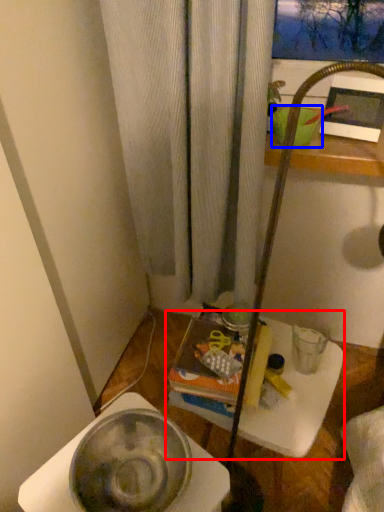
Question: Among these objects, which one is farthest to the camera, table (highlighted by a red box) or basin (highlighted by a blue box)?

Choices:
 (A) table
 (B) basin

Answer: (B)